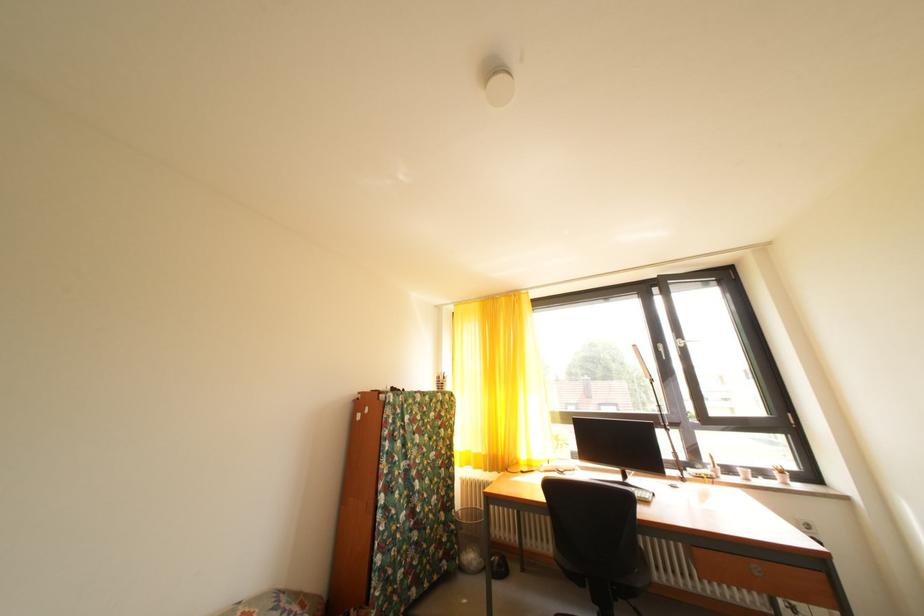
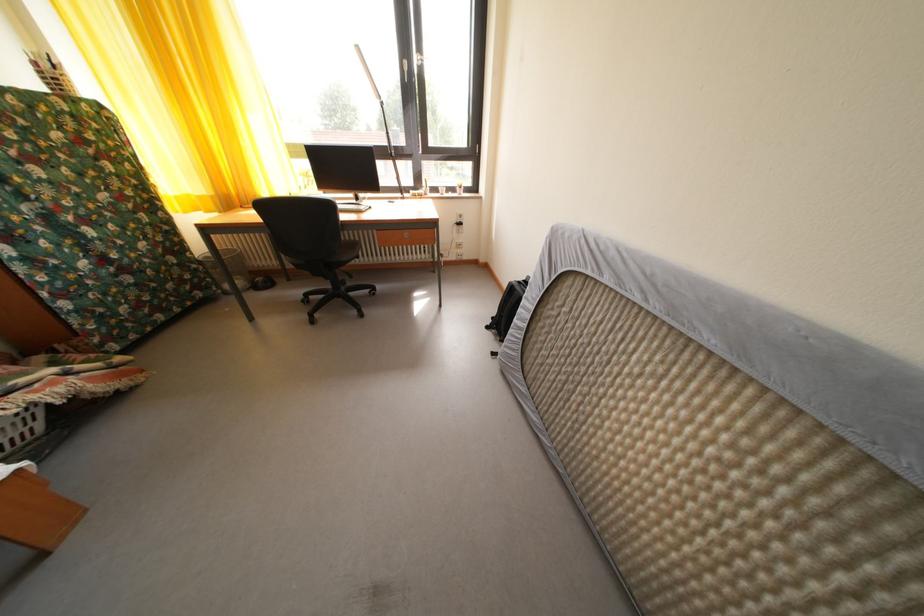
Where in the second image is the point corresponding to pixel 466 541 from the first image?

(215, 278)